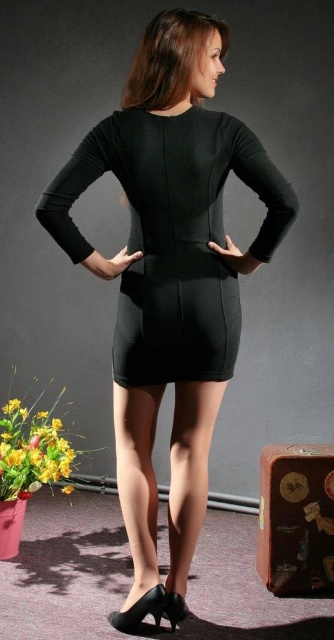
Who is positioned more to the left, black matte dress at center or leather suitcase at lower right?

black matte dress at center

Consider the image. Does black matte dress at center have a lesser width compared to leather suitcase at lower right?

Incorrect, black matte dress at center's width is not less than leather suitcase at lower right's.

Between point (139, 305) and point (325, 525), which one is positioned in front?

Point (139, 305)

Locate an element on the screen. black matte dress at center is located at coordinates [x=173, y=236].

This screenshot has height=640, width=334. What are the coordinates of `black matte dress at center` in the screenshot? It's located at (173, 236).

Does black matte dress at center have a greater width compared to satin smooth stockings at lower center?

Indeed, black matte dress at center has a greater width compared to satin smooth stockings at lower center.

Describe the element at coordinates (173, 236) in the screenshot. I see `black matte dress at center` at that location.

Identify the location of black matte dress at center. The image size is (334, 640). (173, 236).

Who is taller, satin smooth stockings at lower center or leather suitcase at lower right?

With more height is satin smooth stockings at lower center.

Between satin smooth stockings at lower center and leather suitcase at lower right, which one appears on the left side from the viewer's perspective?

From the viewer's perspective, satin smooth stockings at lower center appears more on the left side.

Is point (171, 440) positioned in front of point (321, 504)?

That is True.

Where is `satin smooth stockings at lower center`? satin smooth stockings at lower center is located at coordinates (137, 481).